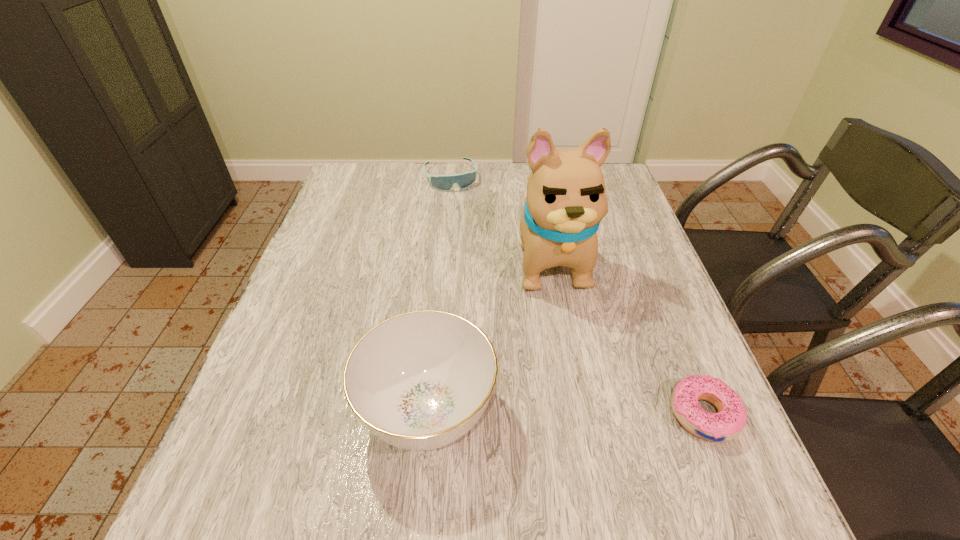
The width and height of the screenshot is (960, 540). In order to click on vacant area situated on the face of the second farthest object in this screenshot , I will do `click(583, 384)`.

The image size is (960, 540). In order to click on free spot located on the front-facing side of the goggles in this screenshot , I will do `click(466, 219)`.

In order to click on vacant space situated on the front-facing side of the goggles in this screenshot , I will do `click(470, 234)`.

This screenshot has height=540, width=960. I want to click on free space located on the front-facing side of the goggles, so click(471, 236).

You are a GUI agent. You are given a task and a screenshot of the screen. Output one action in this format:
    pyautogui.click(x=<x>, y=<y>)
    Task: Click on the object positioned at the far edge
    This screenshot has width=960, height=540.
    Given the screenshot: What is the action you would take?
    pyautogui.click(x=464, y=180)

You are a GUI agent. You are given a task and a screenshot of the screen. Output one action in this format:
    pyautogui.click(x=<x>, y=<y>)
    Task: Click on the chinaware situated at the near edge
    
    Given the screenshot: What is the action you would take?
    pyautogui.click(x=420, y=380)

Where is `doughnut at the near edge`? The width and height of the screenshot is (960, 540). doughnut at the near edge is located at coordinates (727, 424).

The height and width of the screenshot is (540, 960). What are the coordinates of `object at the right edge` in the screenshot? It's located at tap(727, 424).

Where is `object that is at the near right corner`? The width and height of the screenshot is (960, 540). object that is at the near right corner is located at coordinates (727, 424).

Locate an element on the screen. This screenshot has height=540, width=960. free space at the far edge of the desktop is located at coordinates (524, 166).